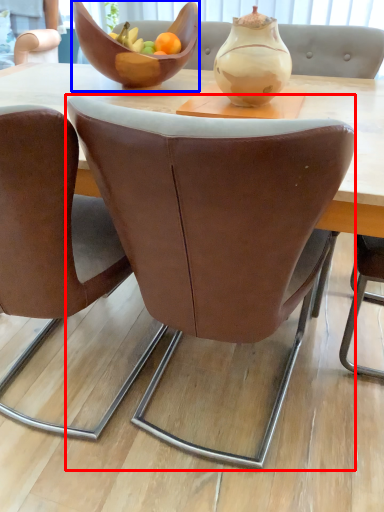
Question: Which of the following is the closest to the observer, chair (highlighted by a red box) or bowl (highlighted by a blue box)?

Choices:
 (A) chair
 (B) bowl

Answer: (A)